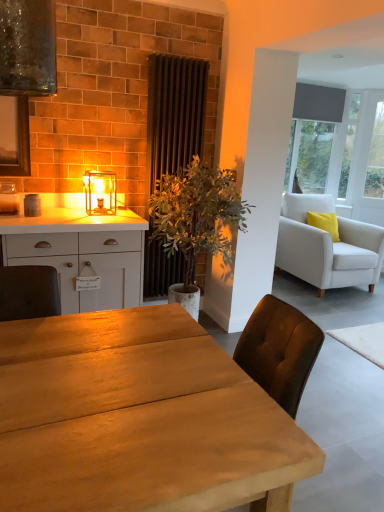
Question: Is white matte cabinet at left next to green leafy plant at center and touching it?

Choices:
 (A) no
 (B) yes

Answer: (A)

Question: Considering the relative sizes of white matte cabinet at left and green leafy plant at center in the image provided, is white matte cabinet at left shorter than green leafy plant at center?

Choices:
 (A) no
 (B) yes

Answer: (B)

Question: Is white matte cabinet at left in front of green leafy plant at center?

Choices:
 (A) no
 (B) yes

Answer: (B)

Question: Considering the relative positions of white matte cabinet at left and green leafy plant at center in the image provided, is white matte cabinet at left to the right of green leafy plant at center from the viewer's perspective?

Choices:
 (A) yes
 (B) no

Answer: (B)

Question: Is white matte cabinet at left not inside green leafy plant at center?

Choices:
 (A) no
 (B) yes

Answer: (B)

Question: Does white matte cabinet at left have a larger size compared to green leafy plant at center?

Choices:
 (A) no
 (B) yes

Answer: (A)

Question: Is matte gray shade at upper right at the back of wooden table at center?

Choices:
 (A) yes
 (B) no

Answer: (B)

Question: Considering the relative sizes of wooden table at center and matte gray shade at upper right in the image provided, is wooden table at center thinner than matte gray shade at upper right?

Choices:
 (A) no
 (B) yes

Answer: (A)

Question: Is matte gray shade at upper right surrounded by wooden table at center?

Choices:
 (A) no
 (B) yes

Answer: (A)

Question: From the image's perspective, is wooden table at center below matte gray shade at upper right?

Choices:
 (A) no
 (B) yes

Answer: (B)

Question: Is wooden table at center positioned in front of matte gray shade at upper right?

Choices:
 (A) yes
 (B) no

Answer: (A)

Question: Is wooden table at center smaller than matte gray shade at upper right?

Choices:
 (A) no
 (B) yes

Answer: (A)

Question: Is matte glass lantern at center wider than white fabric armchair at right?

Choices:
 (A) yes
 (B) no

Answer: (B)